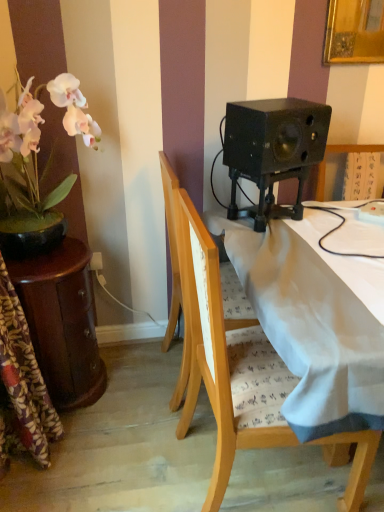
Question: Is black matte speaker at upper right not near mahogany wooden side table at left?

Choices:
 (A) yes
 (B) no

Answer: (B)

Question: Is black matte speaker at upper right turned away from mahogany wooden side table at left?

Choices:
 (A) yes
 (B) no

Answer: (B)

Question: From a real-world perspective, is black matte speaker at upper right positioned under mahogany wooden side table at left based on gravity?

Choices:
 (A) no
 (B) yes

Answer: (A)

Question: Does black matte speaker at upper right have a greater width compared to mahogany wooden side table at left?

Choices:
 (A) no
 (B) yes

Answer: (A)

Question: Does black matte speaker at upper right have a lesser width compared to mahogany wooden side table at left?

Choices:
 (A) yes
 (B) no

Answer: (A)

Question: Would you say wooden chair at center, which ranks as the first chair in back-to-front order, is inside or outside mahogany wooden side table at left?

Choices:
 (A) inside
 (B) outside

Answer: (B)

Question: Would you say wooden chair at center, the 2th chair viewed from the front, is to the left or to the right of mahogany wooden side table at left in the picture?

Choices:
 (A) right
 (B) left

Answer: (A)

Question: From the image's perspective, is wooden chair at center, which ranks as the first chair in back-to-front order, located above or below mahogany wooden side table at left?

Choices:
 (A) above
 (B) below

Answer: (A)

Question: Considering the positions of point (173, 228) and point (54, 298), is point (173, 228) closer or farther from the camera than point (54, 298)?

Choices:
 (A) farther
 (B) closer

Answer: (B)

Question: From a real-world perspective, is mahogany wooden side table at left above or below wooden chair at center, the 2th chair viewed from the front?

Choices:
 (A) below
 (B) above

Answer: (A)

Question: In the image, is mahogany wooden side table at left on the left side or the right side of wooden chair at center, which ranks as the first chair in back-to-front order?

Choices:
 (A) right
 (B) left

Answer: (B)

Question: In terms of size, does mahogany wooden side table at left appear bigger or smaller than wooden chair at center, which ranks as the first chair in back-to-front order?

Choices:
 (A) big
 (B) small

Answer: (B)

Question: In the image, is mahogany wooden side table at left positioned in front of or behind wooden chair at center, the 2th chair viewed from the front?

Choices:
 (A) front
 (B) behind

Answer: (B)

Question: From their relative heights in the image, would you say wooden chair at center, the 1th chair positioned from the front, is taller or shorter than wooden chair at center, which ranks as the first chair in back-to-front order?

Choices:
 (A) short
 (B) tall

Answer: (B)

Question: Relative to wooden chair at center, which ranks as the first chair in back-to-front order, is wooden chair at center, the 2th chair viewed from the back, in front or behind?

Choices:
 (A) front
 (B) behind

Answer: (A)